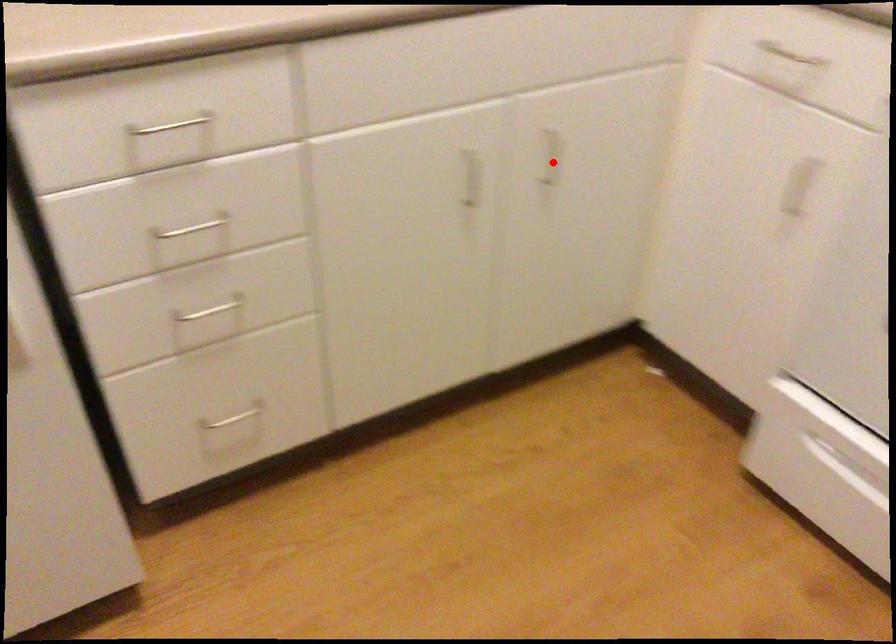
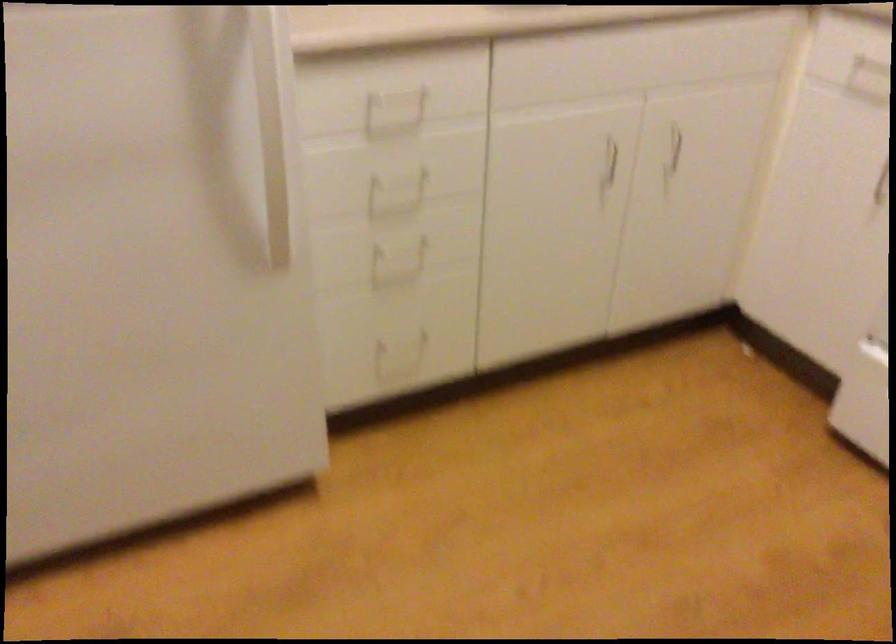
Question: I am providing you with two images of the same scene from different viewpoints. In image1, a red point is highlighted. Considering the same 3D point in image2, which of the following is correct?

Choices:
 (A) It is closer
 (B) It is farther

Answer: (B)